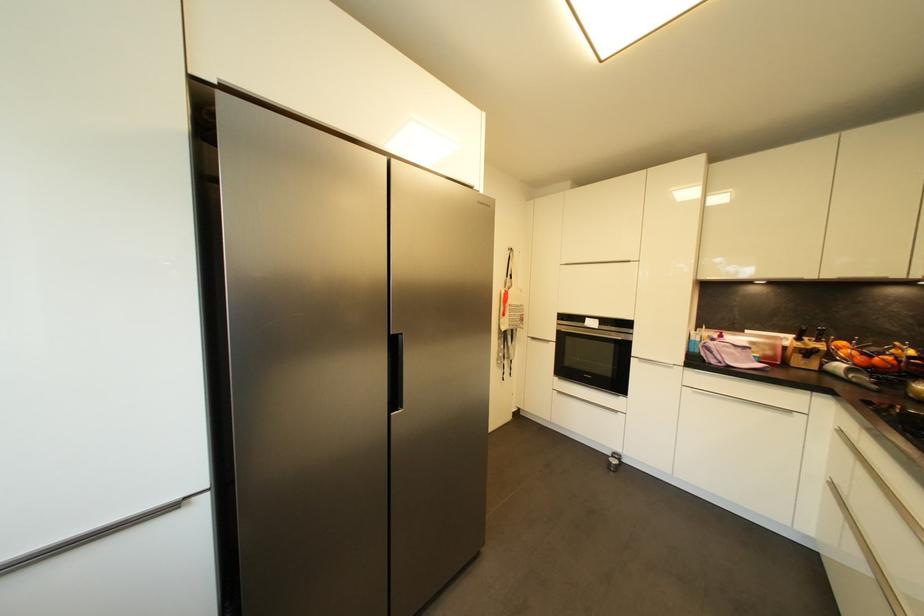
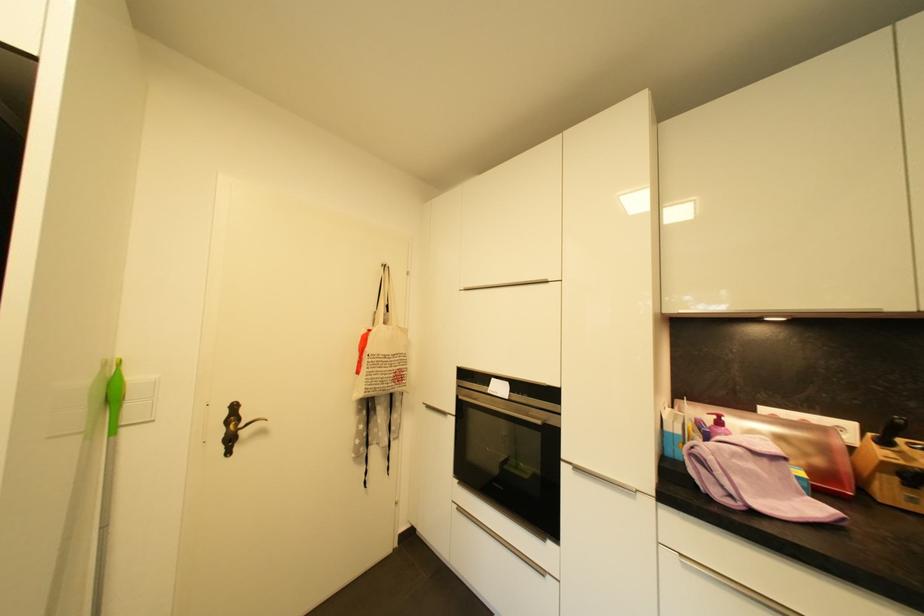
Find the pixel in the second image that matches pixel 725 338 in the first image.

(724, 424)